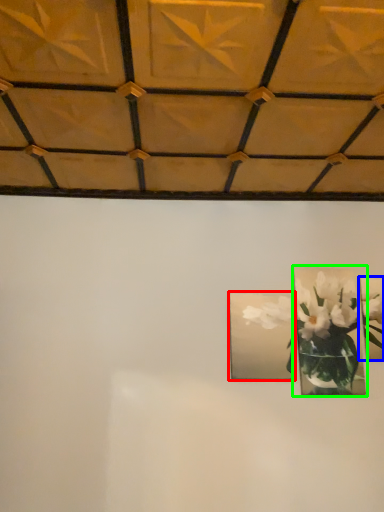
Question: Considering the real-world distances, which object is farthest from picture frame (highlighted by a red box)? picture frame (highlighted by a blue box) or picture frame (highlighted by a green box)?

Choices:
 (A) picture frame
 (B) picture frame

Answer: (A)